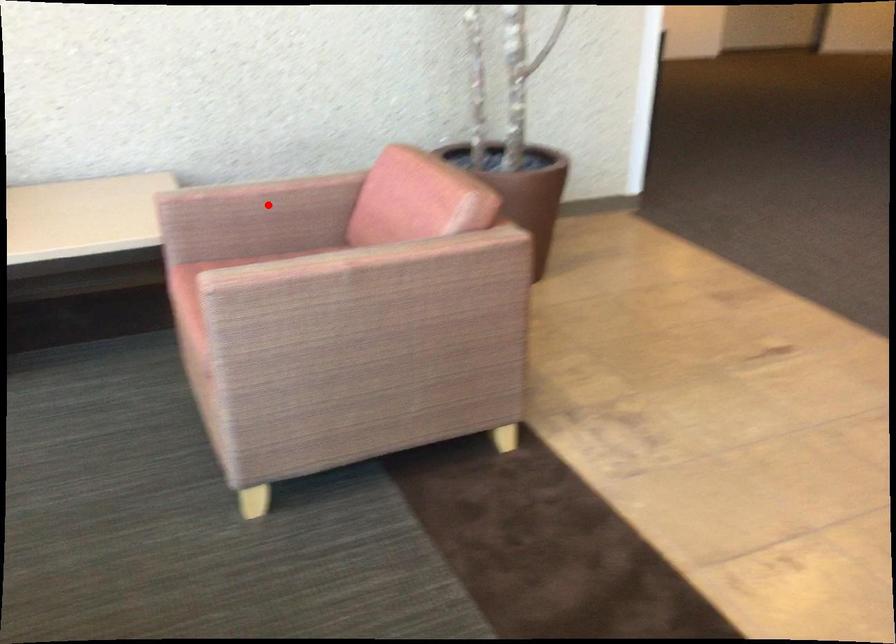
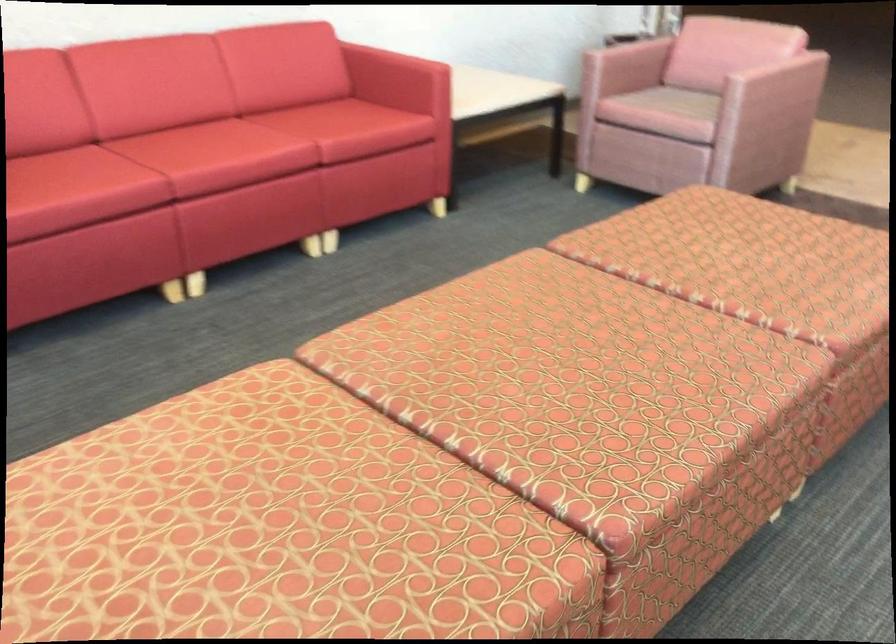
Find the pixel in the second image that matches the highlighted location in the first image.

(627, 58)